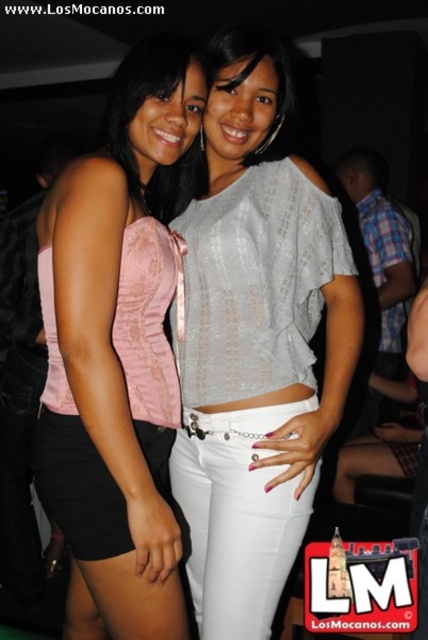
Looking at this image, can you confirm if light gray lace blouse at center is wider than pink satin top at left?

Indeed, light gray lace blouse at center has a greater width compared to pink satin top at left.

Is light gray lace blouse at center below pink satin top at left?

Yes, light gray lace blouse at center is below pink satin top at left.

Image resolution: width=428 pixels, height=640 pixels. Describe the element at coordinates (255, 344) in the screenshot. I see `light gray lace blouse at center` at that location.

Where is `light gray lace blouse at center`? light gray lace blouse at center is located at coordinates (255, 344).